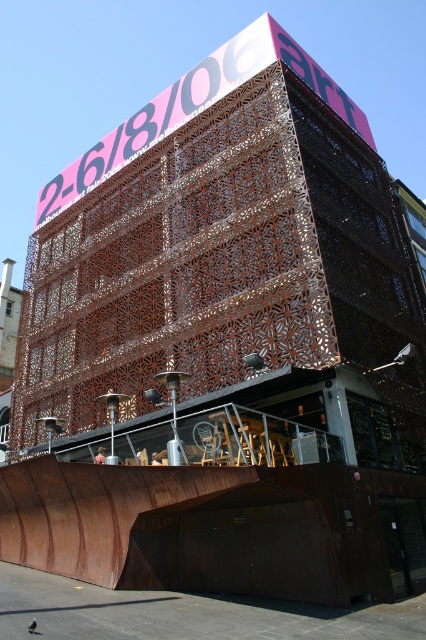
Is rusty metal ramp at lower center closer to the viewer compared to metallic skateboard at center?

Yes, it is in front of metallic skateboard at center.

Is point (83, 492) closer to viewer compared to point (98, 448)?

Yes.

Find the location of a particular element. The height and width of the screenshot is (640, 426). rusty metal ramp at lower center is located at coordinates (89, 512).